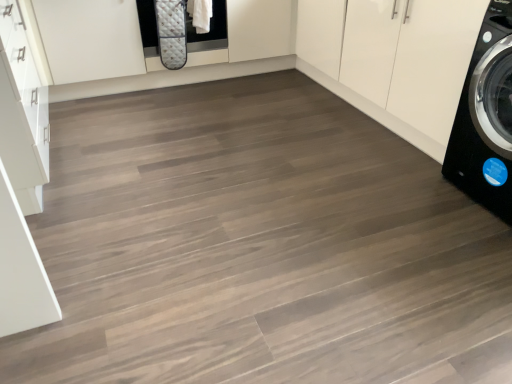
Image resolution: width=512 pixels, height=384 pixels. Describe the element at coordinates (485, 117) in the screenshot. I see `black glossy washing machine at right` at that location.

Locate an element on the screen. The width and height of the screenshot is (512, 384). black glossy washing machine at right is located at coordinates (485, 117).

I want to click on white glossy cabinet at upper right, so click(395, 61).

What is the approximate width of white glossy cabinet at upper right?

62.60 centimeters.

This screenshot has height=384, width=512. What do you see at coordinates (395, 61) in the screenshot?
I see `white glossy cabinet at upper right` at bounding box center [395, 61].

The width and height of the screenshot is (512, 384). Find the location of `black glossy washing machine at right`. black glossy washing machine at right is located at coordinates (485, 117).

Between black glossy washing machine at right and white glossy cabinet at upper right, which one appears on the left side from the viewer's perspective?

white glossy cabinet at upper right.

Which is in front, black glossy washing machine at right or white glossy cabinet at upper right?

black glossy washing machine at right is in front.

Does point (503, 63) come closer to viewer compared to point (424, 57)?

Yes, point (503, 63) is in front of point (424, 57).

From the image's perspective, would you say black glossy washing machine at right is shown under white glossy cabinet at upper right?

Indeed, from the image's perspective, black glossy washing machine at right is shown beneath white glossy cabinet at upper right.

From a real-world perspective, is black glossy washing machine at right over white glossy cabinet at upper right?

Yes.

Considering the sizes of objects black glossy washing machine at right and white glossy cabinet at upper right in the image provided, who is thinner, black glossy washing machine at right or white glossy cabinet at upper right?

With smaller width is black glossy washing machine at right.

Is black glossy washing machine at right taller than white glossy cabinet at upper right?

Yes, black glossy washing machine at right is taller than white glossy cabinet at upper right.

Who is smaller, black glossy washing machine at right or white glossy cabinet at upper right?

black glossy washing machine at right is smaller.

Is white glossy cabinet at upper right a part of black glossy washing machine at right?

No, white glossy cabinet at upper right is located outside of black glossy washing machine at right.

Would you say black glossy washing machine at right is a long distance from white glossy cabinet at upper right?

No, black glossy washing machine at right is not far from white glossy cabinet at upper right.

Is black glossy washing machine at right oriented towards white glossy cabinet at upper right?

No, black glossy washing machine at right is not aimed at white glossy cabinet at upper right.

Where is `washing machine in front of the white glossy cabinet at upper right`? washing machine in front of the white glossy cabinet at upper right is located at coordinates (485, 117).

Does white glossy cabinet at upper right appear on the right side of black glossy washing machine at right?

In fact, white glossy cabinet at upper right is to the left of black glossy washing machine at right.

Is white glossy cabinet at upper right further to the viewer compared to black glossy washing machine at right?

Yes, white glossy cabinet at upper right is further from the viewer.

Which point is more forward, (458, 61) or (510, 201)?

The point (510, 201) is in front.

From the image's perspective, which one is positioned lower, white glossy cabinet at upper right or black glossy washing machine at right?

black glossy washing machine at right, from the image's perspective.

From a real-world perspective, between white glossy cabinet at upper right and black glossy washing machine at right, who is vertically higher?

A: In real-world perspective, black glossy washing machine at right is above.

Between white glossy cabinet at upper right and black glossy washing machine at right, which one has larger width?

With larger width is white glossy cabinet at upper right.

Does white glossy cabinet at upper right have a greater height compared to black glossy washing machine at right?

No, white glossy cabinet at upper right is not taller than black glossy washing machine at right.

Looking at this image, considering the sizes of objects white glossy cabinet at upper right and black glossy washing machine at right in the image provided, who is bigger, white glossy cabinet at upper right or black glossy washing machine at right?

white glossy cabinet at upper right.

Choose the correct answer: Is white glossy cabinet at upper right inside black glossy washing machine at right or outside it?

The correct answer is: outside.

Would you consider white glossy cabinet at upper right to be distant from black glossy washing machine at right?

They are positioned close to each other.

Consider the image. Could you tell me if white glossy cabinet at upper right is turned towards black glossy washing machine at right?

No, white glossy cabinet at upper right does not turn towards black glossy washing machine at right.

Based on the photo, how many degrees apart are the facing directions of white glossy cabinet at upper right and black glossy washing machine at right?

They differ by 0.0222 degrees in their facing directions.

How distant is white glossy cabinet at upper right from black glossy washing machine at right?

They are 16.14 inches apart.

Locate an element on the screen. The width and height of the screenshot is (512, 384). cabinetry lying above the black glossy washing machine at right (from the image's perspective) is located at coordinates (395, 61).

I want to click on cabinetry on the left of black glossy washing machine at right, so click(395, 61).

The image size is (512, 384). Identify the location of washing machine located below the white glossy cabinet at upper right (from the image's perspective). (485, 117).